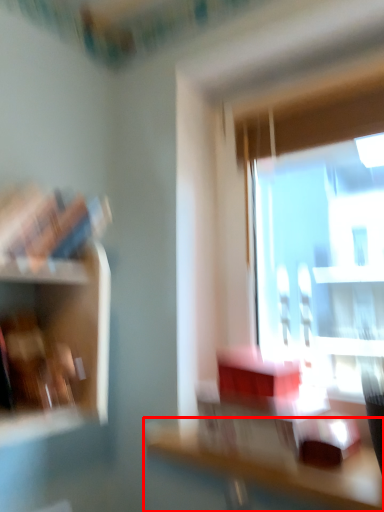
Question: From the image, what is the correct spatial relationship of table (annotated by the red box) in relation to shelf?

Choices:
 (A) left
 (B) right

Answer: (B)